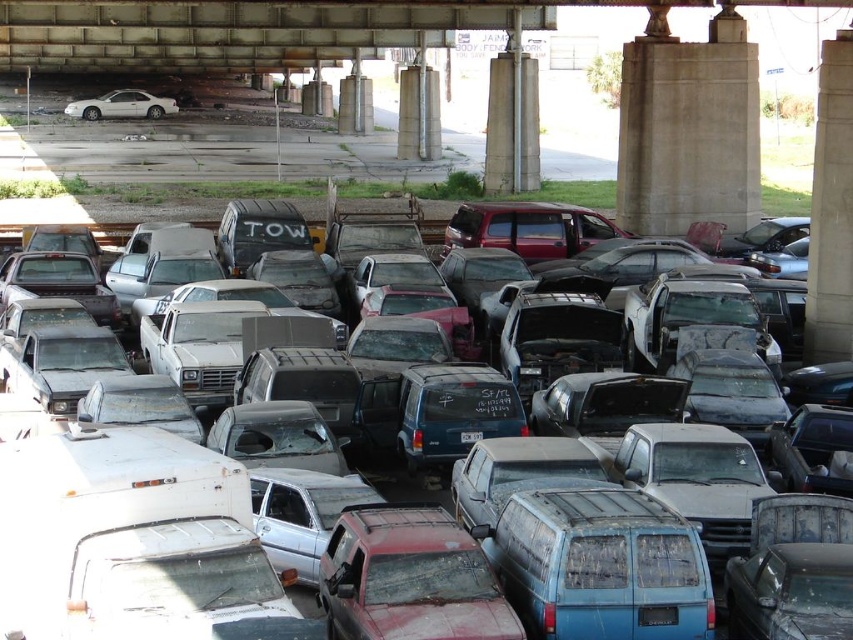
You are a delivery person trying to navigate through the vehicle pile under the bridge. You need to place a package on the highest object in the area. Which object should you choose between the white glossy sedan at upper left and the white plastic license plate at center?

The white glossy sedan at upper left has a greater height compared to the white plastic license plate at center, so you should choose the white glossy sedan at upper left to place the package.

You are a delivery driver who needs to navigate through the vehicle pile under the bridge. You see a point marked at coordinates (x=704, y=314). What vehicle is located at this point?

The point at coordinates (x=704, y=314) marks the location of the rusty metal truck at center.